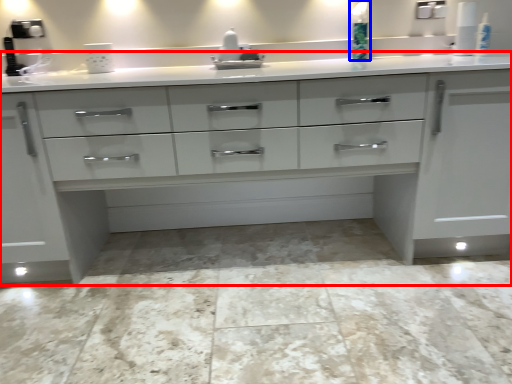
Question: Which of the following is the farthest to the observer, chest of drawers (highlighted by a red box) or soap dispenser (highlighted by a blue box)?

Choices:
 (A) chest of drawers
 (B) soap dispenser

Answer: (B)